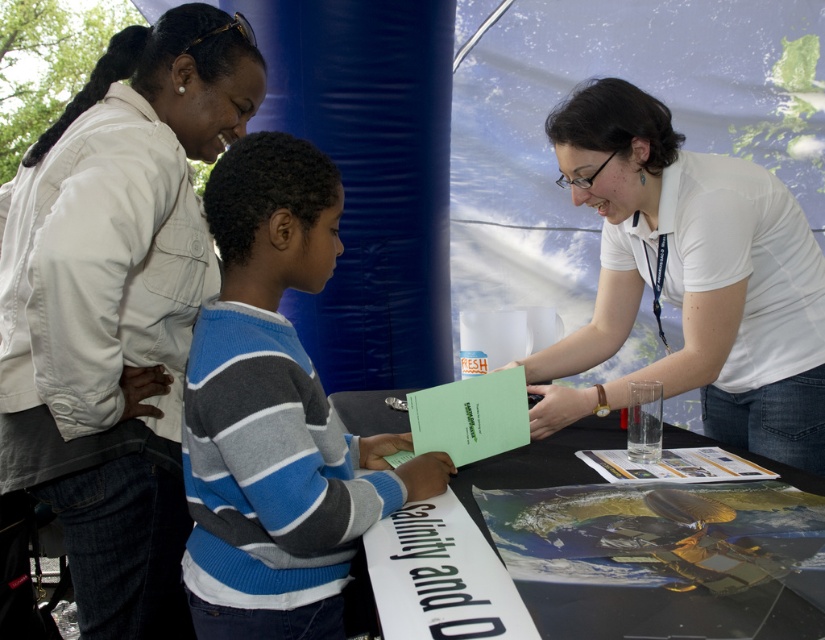
Question: Which object is the closest to the striped sweater at center?

Choices:
 (A) white matte shirt at center
 (B) white cotton jacket at upper left
 (C) black paper at lower center

Answer: (C)

Question: Does striped sweater at center have a lesser width compared to black plastic table at center?

Choices:
 (A) no
 (B) yes

Answer: (B)

Question: Which object is positioned farthest from the black plastic table at center?

Choices:
 (A) white cotton jacket at upper left
 (B) striped sweater at center
 (C) white matte shirt at center
 (D) black paper at lower center

Answer: (A)

Question: Which object is positioned farthest from the black plastic table at center?

Choices:
 (A) striped sweater at center
 (B) black paper at lower center
 (C) white cotton jacket at upper left

Answer: (C)

Question: Does black plastic table at center appear under black paper at lower center?

Choices:
 (A) no
 (B) yes

Answer: (A)

Question: Is striped sweater at center thinner than white matte shirt at center?

Choices:
 (A) no
 (B) yes

Answer: (B)